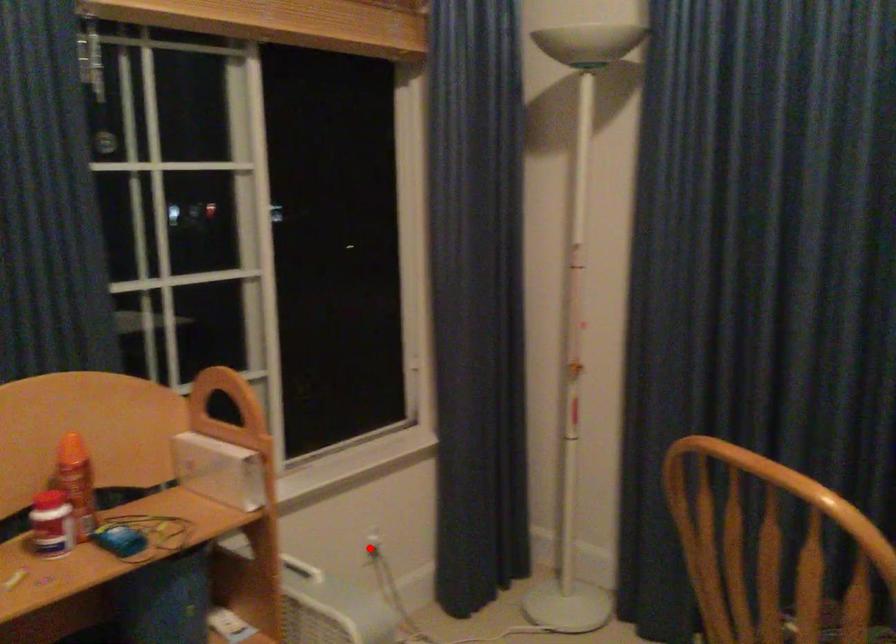
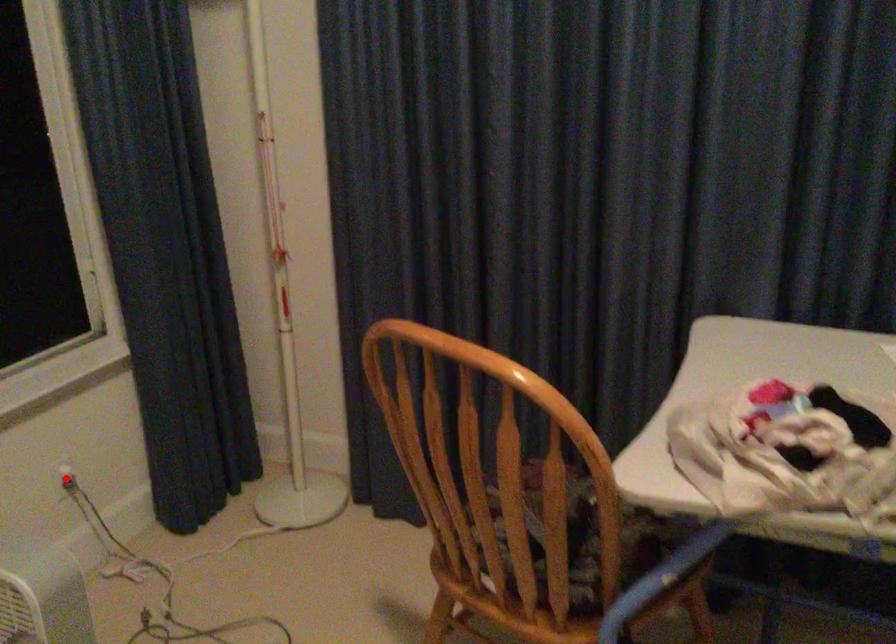
I am providing you with two images of the same scene from different viewpoints. A red point is marked on the first image and another point is marked on the second image. Is the red point in image1 aligned with the point shown in image2?

Yes